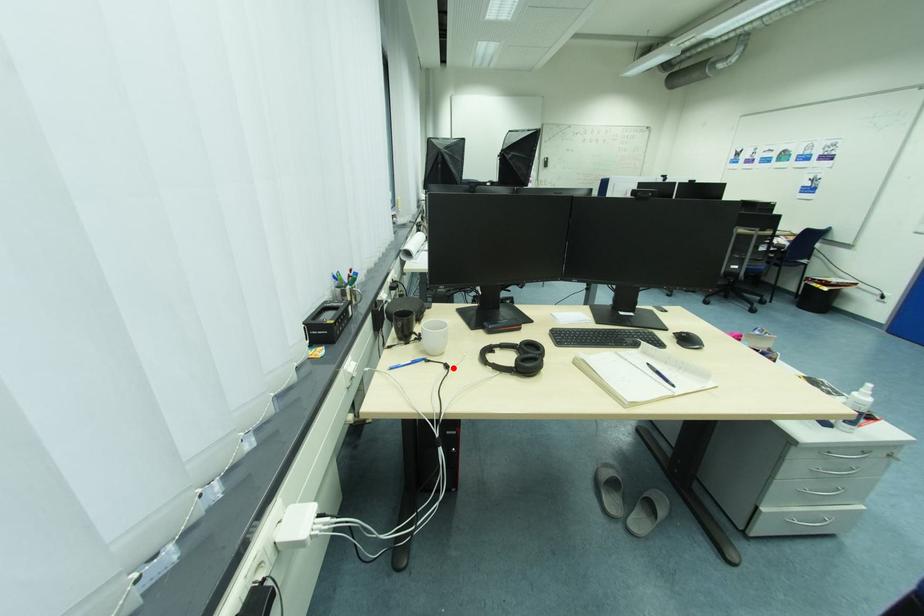
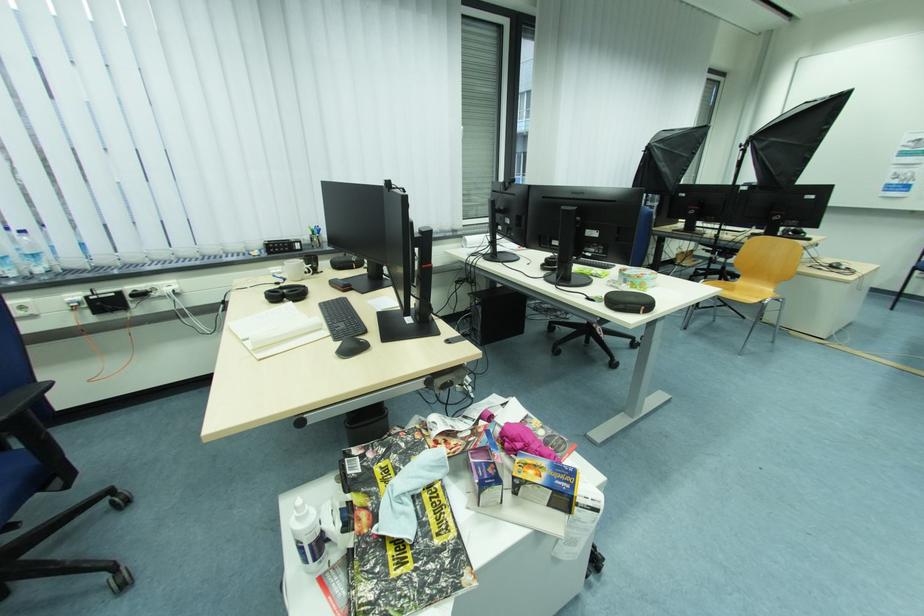
Question: I am providing you with two images of the same scene from different viewpoints. A red point is marked on the first image. Can you still see the location of the red point in image 2?

Choices:
 (A) Yes
 (B) No

Answer: (A)